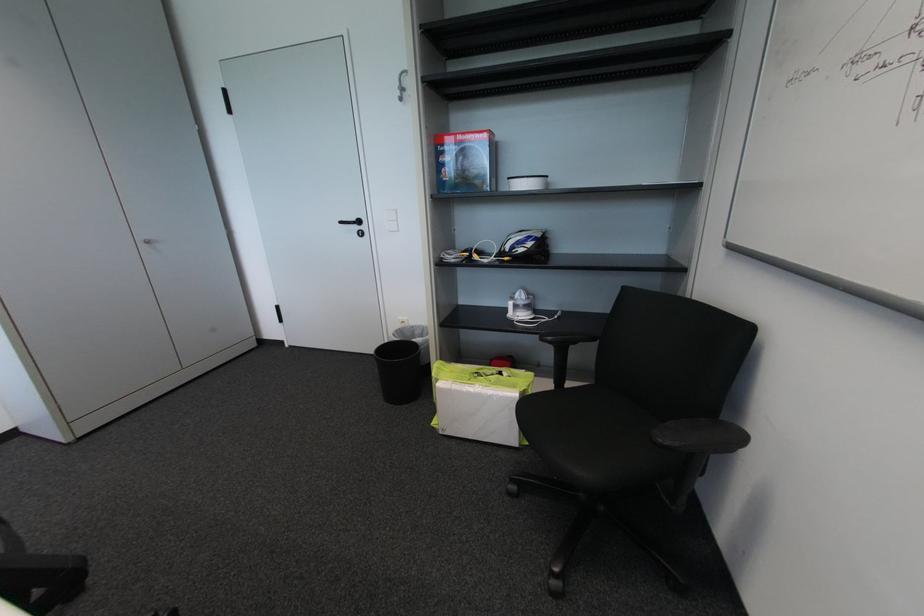
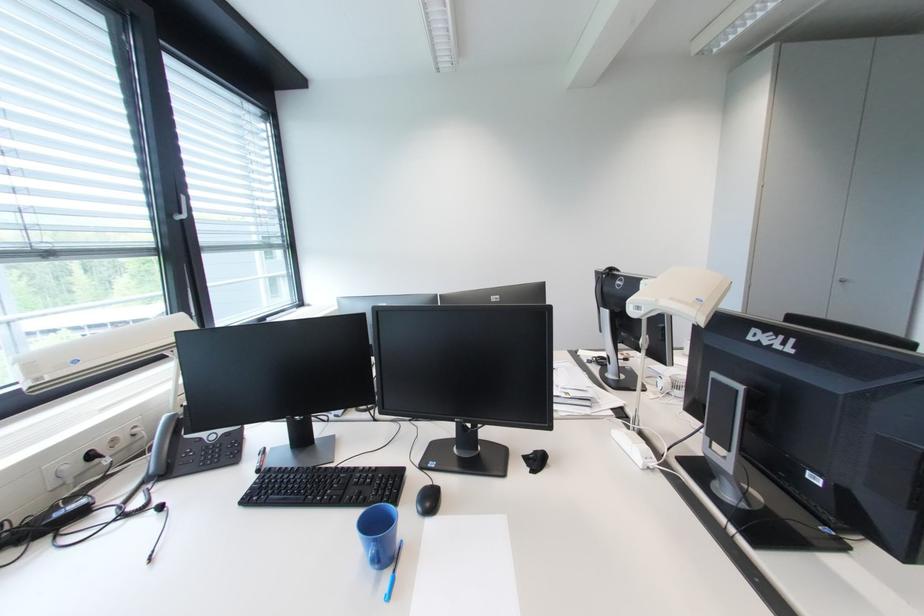
In the second image, find the point that corresponds to pixel 151 246 in the first image.

(844, 285)